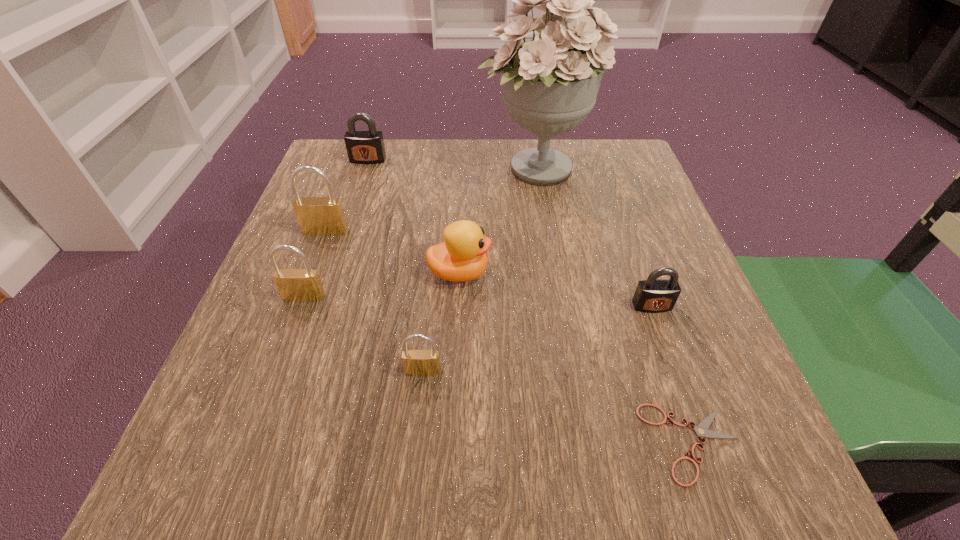
Find the location of a particular element. This screenshot has width=960, height=540. bouquet is located at coordinates point(550,83).

At what (x,y) coordinates should I click in order to perform the action: click on the tallest object. Please return your answer as a coordinate pair (x, y). The height and width of the screenshot is (540, 960). Looking at the image, I should click on (550, 83).

This screenshot has width=960, height=540. Find the location of `the biggest brass padlock`. the biggest brass padlock is located at coordinates (323, 216).

You are a GUI agent. You are given a task and a screenshot of the screen. Output one action in this format:
    pyautogui.click(x=<x>, y=<y>)
    Task: Click on the farthest brass padlock
    
    Given the screenshot: What is the action you would take?
    pyautogui.click(x=323, y=216)

Find the location of a particular element. The image size is (960, 540). the left gray padlock is located at coordinates (363, 147).

Find the location of a particular element. The width and height of the screenshot is (960, 540). the farthest padlock is located at coordinates (363, 147).

At what (x,y) coordinates should I click in order to perform the action: click on the second biggest brass padlock. Please return your answer as a coordinate pair (x, y). The image size is (960, 540). Looking at the image, I should click on (296, 285).

The image size is (960, 540). What are the coordinates of `the fifth nearest object` in the screenshot? It's located at (462, 257).

At what (x,y) coordinates should I click in order to perform the action: click on yellow duckling. Please return your answer as a coordinate pair (x, y). The image size is (960, 540). Looking at the image, I should click on (462, 257).

This screenshot has width=960, height=540. Find the location of `the right gray padlock`. the right gray padlock is located at coordinates (653, 295).